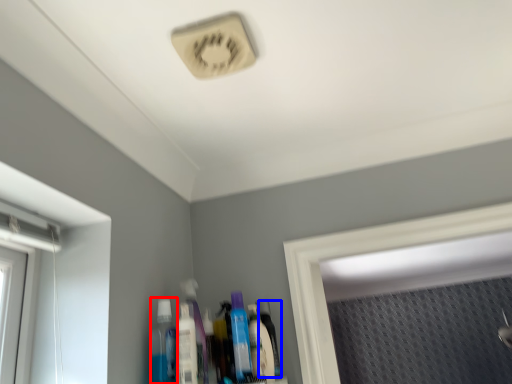
Question: Which of the following is the closest to the observer, mouthwash (highlighted by a red box) or bottle (highlighted by a blue box)?

Choices:
 (A) mouthwash
 (B) bottle

Answer: (A)